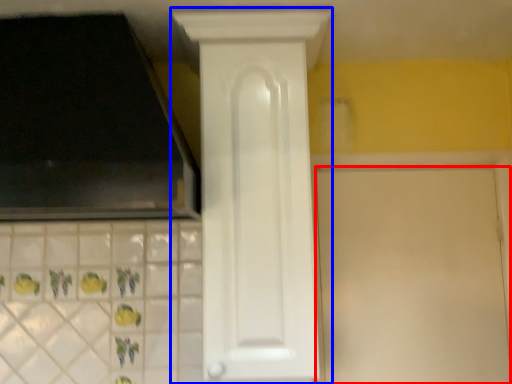
Question: Which object is closer to the camera taking this photo, door (highlighted by a red box) or door (highlighted by a blue box)?

Choices:
 (A) door
 (B) door

Answer: (B)